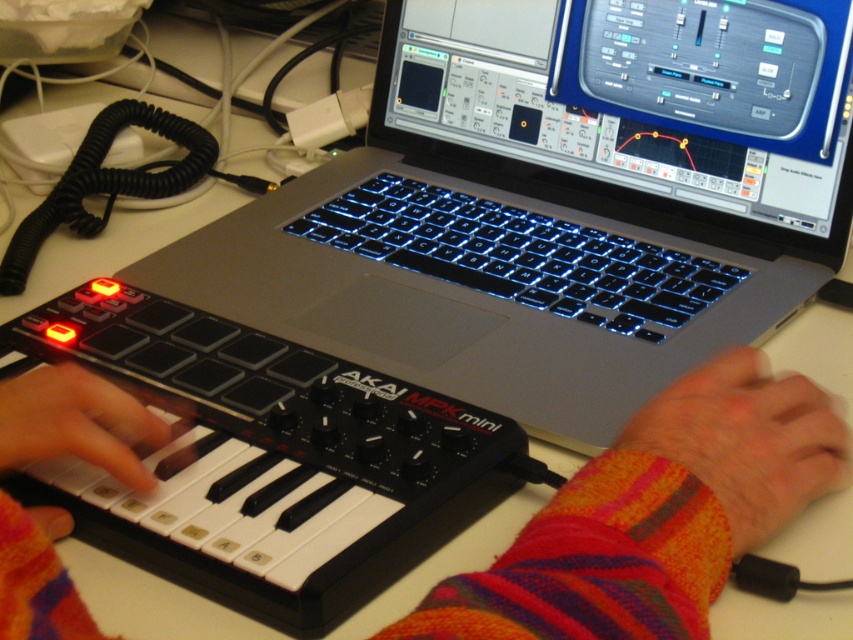
Describe the element at coordinates (520, 253) in the screenshot. I see `glossy plastic keyboard at center` at that location.

Who is positioned more to the left, glossy plastic keyboard at center or knitted fabric wristband at lower right?

glossy plastic keyboard at center is more to the left.

At what (x,y) coordinates should I click in order to perform the action: click on glossy plastic keyboard at center. Please return your answer as a coordinate pair (x, y). The width and height of the screenshot is (853, 640). Looking at the image, I should click on click(x=520, y=253).

In the scene shown: Can you confirm if plaid sweater at lower left is bigger than knitted fabric wristband at lower right?

Yes.

Consider the image. Can you confirm if plaid sweater at lower left is thinner than knitted fabric wristband at lower right?

No, plaid sweater at lower left is not thinner than knitted fabric wristband at lower right.

Does point (817, 435) come closer to viewer compared to point (735, 508)?

No, (817, 435) is behind (735, 508).

The width and height of the screenshot is (853, 640). I want to click on plaid sweater at lower left, so click(654, 515).

Does sleek silver laptop at center appear under white matte keyboard at lower left?

Incorrect, sleek silver laptop at center is not positioned below white matte keyboard at lower left.

Between point (379, 291) and point (39, 381), which one is positioned in front?

Positioned in front is point (39, 381).

Identify the location of sleek silver laptop at center. (555, 202).